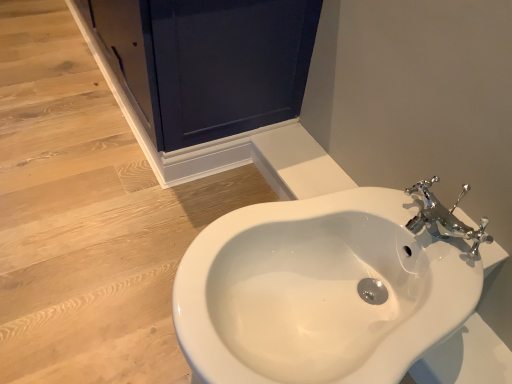
Question: From the image's perspective, would you say white glossy sink at center is positioned over matte dark blue screen door at upper left?

Choices:
 (A) yes
 (B) no

Answer: (B)

Question: Is matte dark blue screen door at upper left at the back of white glossy sink at center?

Choices:
 (A) no
 (B) yes

Answer: (A)

Question: Is white glossy sink at center positioned far away from matte dark blue screen door at upper left?

Choices:
 (A) yes
 (B) no

Answer: (B)

Question: From a real-world perspective, is white glossy sink at center on matte dark blue screen door at upper left?

Choices:
 (A) no
 (B) yes

Answer: (A)

Question: From a real-world perspective, does white glossy sink at center sit lower than matte dark blue screen door at upper left?

Choices:
 (A) yes
 (B) no

Answer: (A)

Question: From the image's perspective, is white glossy sink at center below matte dark blue screen door at upper left?

Choices:
 (A) yes
 (B) no

Answer: (A)

Question: Considering the relative sizes of matte dark blue screen door at upper left and white glossy sink at center in the image provided, is matte dark blue screen door at upper left wider than white glossy sink at center?

Choices:
 (A) yes
 (B) no

Answer: (B)

Question: Considering the relative sizes of matte dark blue screen door at upper left and white glossy sink at center in the image provided, is matte dark blue screen door at upper left thinner than white glossy sink at center?

Choices:
 (A) no
 (B) yes

Answer: (B)

Question: Is matte dark blue screen door at upper left to the right of white glossy sink at center from the viewer's perspective?

Choices:
 (A) yes
 (B) no

Answer: (B)

Question: Considering the relative sizes of matte dark blue screen door at upper left and white glossy sink at center in the image provided, is matte dark blue screen door at upper left bigger than white glossy sink at center?

Choices:
 (A) no
 (B) yes

Answer: (B)

Question: Considering the relative sizes of matte dark blue screen door at upper left and white glossy sink at center in the image provided, is matte dark blue screen door at upper left shorter than white glossy sink at center?

Choices:
 (A) no
 (B) yes

Answer: (A)

Question: From a real-world perspective, is matte dark blue screen door at upper left below white glossy sink at center?

Choices:
 (A) no
 (B) yes

Answer: (A)

Question: Considering the positions of white glossy sink at center and matte dark blue screen door at upper left in the image, is white glossy sink at center bigger or smaller than matte dark blue screen door at upper left?

Choices:
 (A) small
 (B) big

Answer: (A)